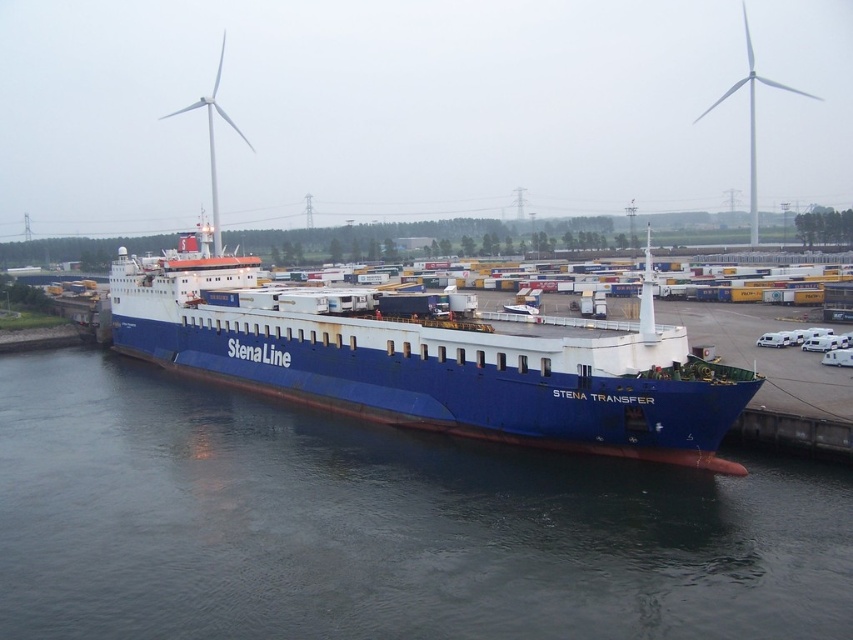
Question: Does blue metallic water at center appear on the left side of blue matte ship at center?

Choices:
 (A) no
 (B) yes

Answer: (A)

Question: Which point appears farthest from the camera in this image?

Choices:
 (A) (550, 440)
 (B) (849, 570)

Answer: (A)

Question: Is blue metallic water at center behind blue matte ship at center?

Choices:
 (A) yes
 (B) no

Answer: (B)

Question: Is the position of blue metallic water at center less distant than that of blue matte ship at center?

Choices:
 (A) no
 (B) yes

Answer: (B)

Question: Which of the following is the closest to the observer?

Choices:
 (A) blue metallic water at center
 (B) blue matte ship at center

Answer: (A)

Question: Which object appears farthest from the camera in this image?

Choices:
 (A) blue matte ship at center
 (B) blue metallic water at center

Answer: (A)